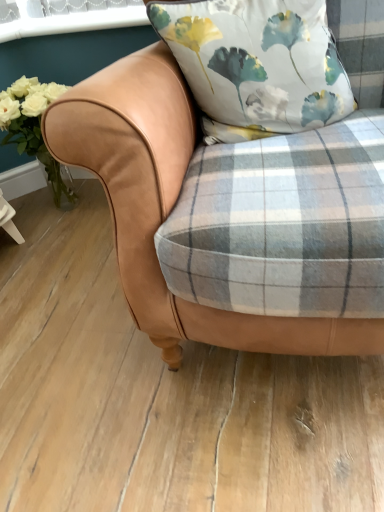
Question: From a real-world perspective, is tan leather chair at center physically above silky floral pillow at center?

Choices:
 (A) yes
 (B) no

Answer: (B)

Question: Does tan leather chair at center have a lesser width compared to silky floral pillow at center?

Choices:
 (A) no
 (B) yes

Answer: (A)

Question: From a real-world perspective, is tan leather chair at center under silky floral pillow at center?

Choices:
 (A) yes
 (B) no

Answer: (A)

Question: Is tan leather chair at center taller than silky floral pillow at center?

Choices:
 (A) no
 (B) yes

Answer: (B)

Question: Is tan leather chair at center located outside silky floral pillow at center?

Choices:
 (A) yes
 (B) no

Answer: (A)

Question: Considering the positions of silky floral pillow at center and white matte flowers at left in the image, is silky floral pillow at center wider or thinner than white matte flowers at left?

Choices:
 (A) wide
 (B) thin

Answer: (B)

Question: Looking at the image, does silky floral pillow at center seem bigger or smaller compared to white matte flowers at left?

Choices:
 (A) small
 (B) big

Answer: (A)

Question: Relative to white matte flowers at left, is silky floral pillow at center in front or behind?

Choices:
 (A) front
 (B) behind

Answer: (A)

Question: In the image, is silky floral pillow at center on the left side or the right side of white matte flowers at left?

Choices:
 (A) right
 (B) left

Answer: (A)

Question: Is silky floral pillow at center wider or thinner than tan leather chair at center?

Choices:
 (A) wide
 (B) thin

Answer: (B)

Question: Which is correct: silky floral pillow at center is inside tan leather chair at center, or outside of it?

Choices:
 (A) inside
 (B) outside

Answer: (A)

Question: Based on their sizes in the image, would you say silky floral pillow at center is bigger or smaller than tan leather chair at center?

Choices:
 (A) big
 (B) small

Answer: (B)

Question: From the image's perspective, relative to tan leather chair at center, is silky floral pillow at center above or below?

Choices:
 (A) below
 (B) above

Answer: (B)

Question: Choose the correct answer: Is tan leather chair at center inside silky floral pillow at center or outside it?

Choices:
 (A) inside
 (B) outside

Answer: (B)

Question: Does point (162, 158) appear closer or farther from the camera than point (311, 20)?

Choices:
 (A) farther
 (B) closer

Answer: (B)